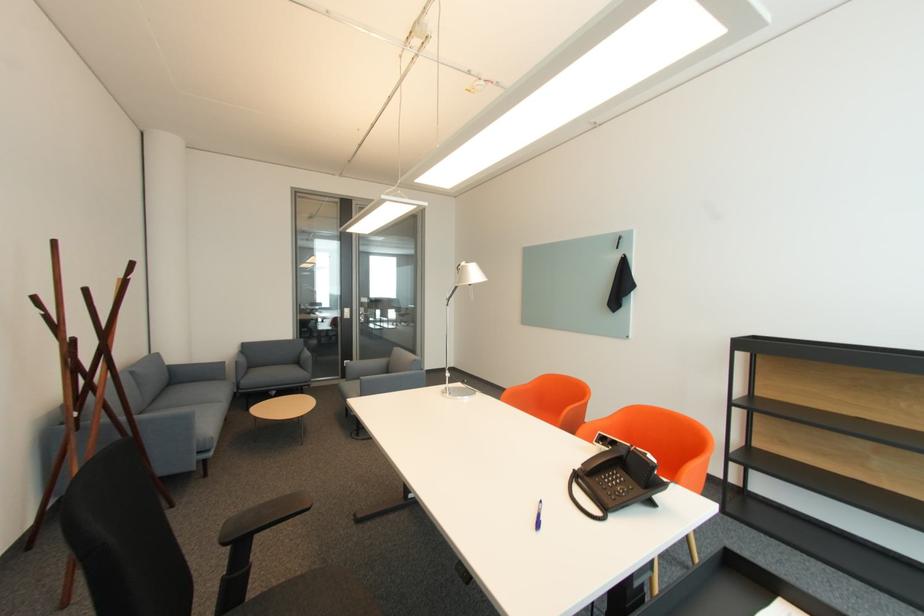
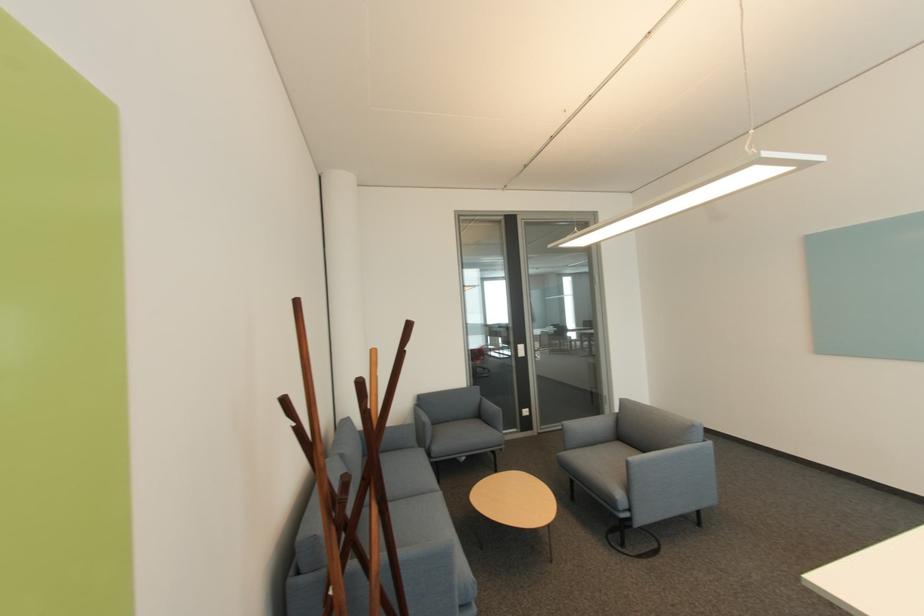
Which direction would the cameraman need to move to produce the second image?

The cameraman moved toward left, forward.